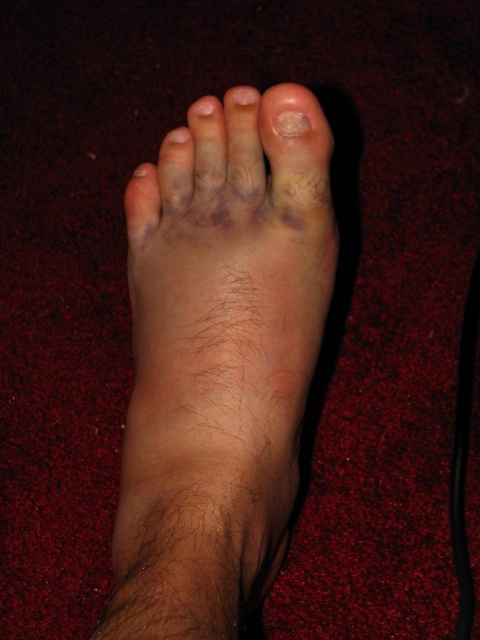
You are a medical student observing a patient. The patient has a foot injury. You need to locate the point at coordinates point (218, 358). Where exactly is this point located on the patient?

The point (218, 358) is located on the dry skin foot at center, which is the area showing discoloration and swelling around the big toe and surrounding area.

Looking at this image, you are a medical professional examining a patient. The patient has a foot injury and you need to assess the distance between the dry skin foot at center and yourself. Based on the scene, can you determine if the foot is within a safe examination distance of 12 inches?

The distance between the dry skin foot at center and the viewer is 11.11 inches, which is within the safe examination distance of 12 inches. Therefore, the foot is at a safe distance for examination.